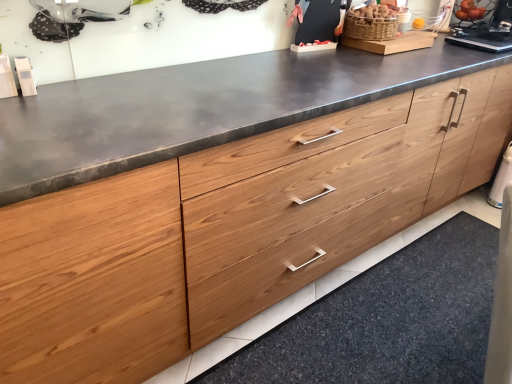
Question: Is woven brown basket at upper right outside of natural wood drawer at lower center?

Choices:
 (A) no
 (B) yes

Answer: (B)

Question: Does woven brown basket at upper right have a larger size compared to natural wood drawer at lower center?

Choices:
 (A) no
 (B) yes

Answer: (A)

Question: Does woven brown basket at upper right appear on the right side of natural wood drawer at lower center?

Choices:
 (A) no
 (B) yes

Answer: (A)

Question: Does woven brown basket at upper right come behind natural wood drawer at lower center?

Choices:
 (A) yes
 (B) no

Answer: (A)

Question: Is woven brown basket at upper right taller than natural wood drawer at lower center?

Choices:
 (A) yes
 (B) no

Answer: (A)

Question: Could you tell me if woven brown basket at upper right is turned towards natural wood drawer at lower center?

Choices:
 (A) no
 (B) yes

Answer: (A)

Question: Does natural wood drawer at lower center come in front of woven brown basket at upper right?

Choices:
 (A) yes
 (B) no

Answer: (A)

Question: Considering the relative positions of natural wood drawer at lower center and woven brown basket at upper right in the image provided, is natural wood drawer at lower center to the right of woven brown basket at upper right from the viewer's perspective?

Choices:
 (A) no
 (B) yes

Answer: (B)

Question: Does natural wood drawer at lower center have a greater height compared to woven brown basket at upper right?

Choices:
 (A) no
 (B) yes

Answer: (A)

Question: Is woven brown basket at upper right surrounded by natural wood drawer at lower center?

Choices:
 (A) no
 (B) yes

Answer: (A)

Question: Is natural wood drawer at lower center smaller than woven brown basket at upper right?

Choices:
 (A) yes
 (B) no

Answer: (B)

Question: Can you confirm if natural wood drawer at lower center is wider than woven brown basket at upper right?

Choices:
 (A) no
 (B) yes

Answer: (B)

Question: Is point (366, 23) positioned closer to the camera than point (437, 375)?

Choices:
 (A) closer
 (B) farther

Answer: (B)